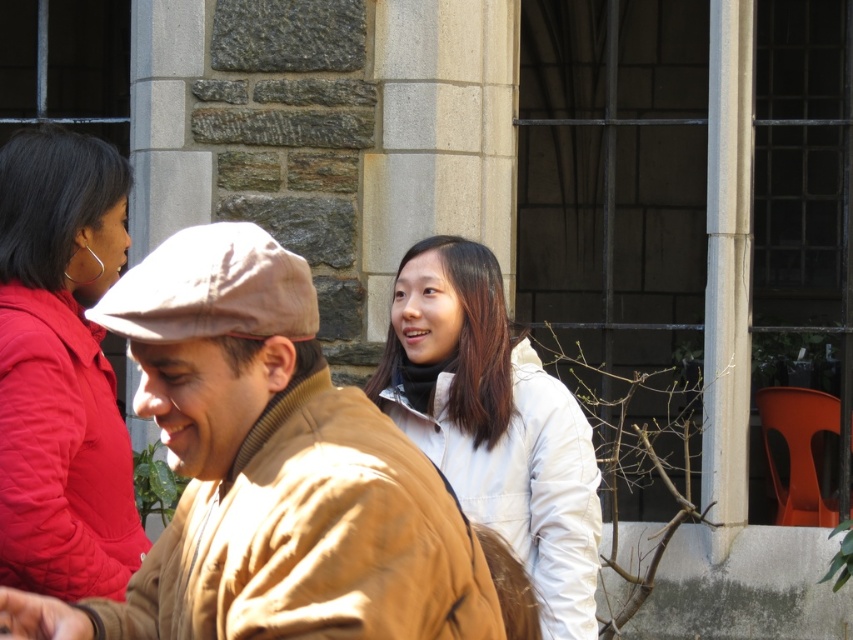
You are standing in front of a historical building and want to take a photo of two points marked in the image. The first point is at coordinates point (x=119, y=488) and the second is at point (x=529, y=353). Which point will appear closer to you in the photo?

Point (x=119, y=488) is closer to the viewer than point (x=529, y=353), so it will appear closer in the photo.

You are a fashion designer observing the three people in the scene. You need to determine which jacket between the brown woolen jacket at center and the white matte jacket at center is more suitable for a winter collection. Based on their sizes, which one would you choose?

The brown woolen jacket at center has a larger size compared to the white matte jacket at center, making it more suitable for a winter collection as larger jackets typically provide better insulation and warmth.